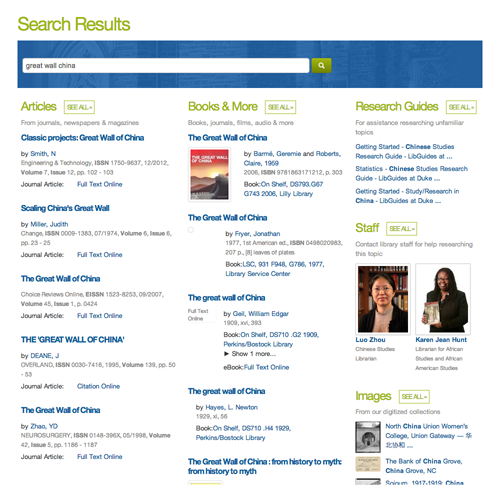
I want to click on books, so click(399, 292).